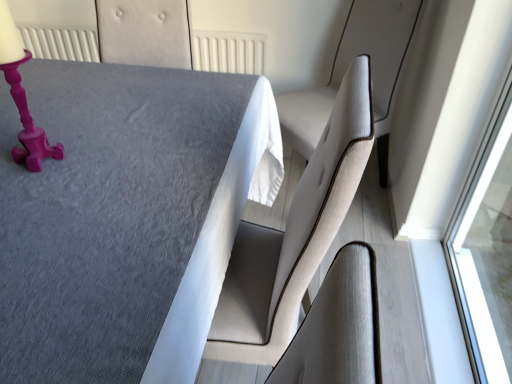
Question: Is textured gray table at center at the back of matte pink candlestick at upper left?

Choices:
 (A) no
 (B) yes

Answer: (B)

Question: Is matte pink candlestick at upper left oriented towards textured gray table at center?

Choices:
 (A) no
 (B) yes

Answer: (A)

Question: Is matte pink candlestick at upper left outside of textured gray table at center?

Choices:
 (A) yes
 (B) no

Answer: (A)

Question: Considering the relative positions of matte pink candlestick at upper left and textured gray table at center in the image provided, is matte pink candlestick at upper left to the left of textured gray table at center from the viewer's perspective?

Choices:
 (A) yes
 (B) no

Answer: (A)

Question: Is matte pink candlestick at upper left thinner than textured gray table at center?

Choices:
 (A) no
 (B) yes

Answer: (B)

Question: Based on their sizes in the image, would you say matte pink candlestick at upper left is bigger or smaller than light beige fabric swivel chair at right?

Choices:
 (A) big
 (B) small

Answer: (B)

Question: Considering the positions of matte pink candlestick at upper left and light beige fabric swivel chair at right in the image, is matte pink candlestick at upper left taller or shorter than light beige fabric swivel chair at right?

Choices:
 (A) tall
 (B) short

Answer: (B)

Question: In the image, is matte pink candlestick at upper left on the left side or the right side of light beige fabric swivel chair at right?

Choices:
 (A) left
 (B) right

Answer: (A)

Question: Is matte pink candlestick at upper left inside the boundaries of light beige fabric swivel chair at right, or outside?

Choices:
 (A) outside
 (B) inside

Answer: (A)

Question: Based on their sizes in the image, would you say matte pink candlestick at upper left is bigger or smaller than textured gray table at center?

Choices:
 (A) small
 (B) big

Answer: (A)

Question: From a real-world perspective, relative to textured gray table at center, is matte pink candlestick at upper left vertically above or below?

Choices:
 (A) above
 (B) below

Answer: (A)

Question: Is matte pink candlestick at upper left spatially inside textured gray table at center, or outside of it?

Choices:
 (A) inside
 (B) outside

Answer: (B)

Question: From the image's perspective, relative to textured gray table at center, is matte pink candlestick at upper left above or below?

Choices:
 (A) below
 (B) above

Answer: (B)

Question: Based on their positions, is textured gray table at center located to the left or right of matte pink candlestick at upper left?

Choices:
 (A) right
 (B) left

Answer: (A)

Question: Is textured gray table at center in front of or behind matte pink candlestick at upper left in the image?

Choices:
 (A) behind
 (B) front

Answer: (B)